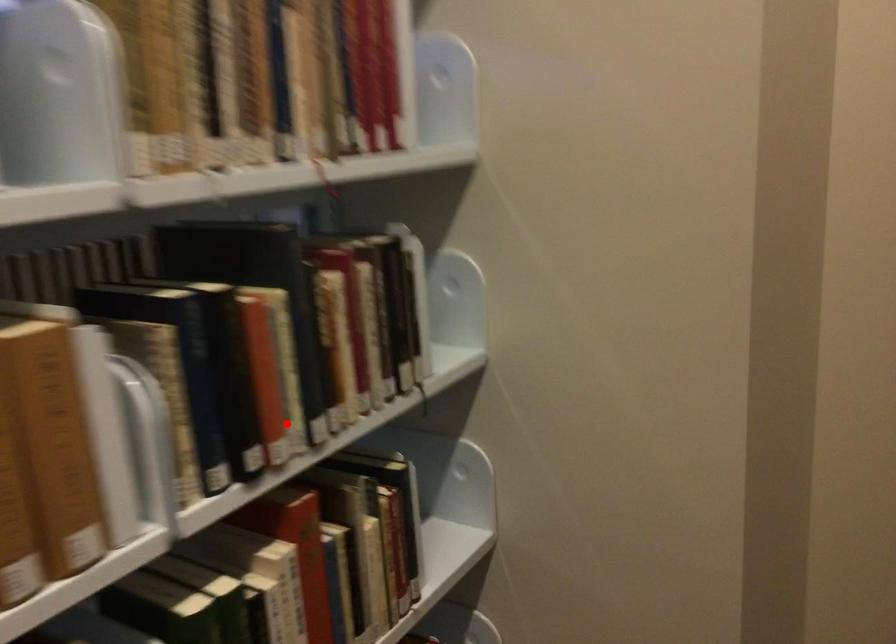
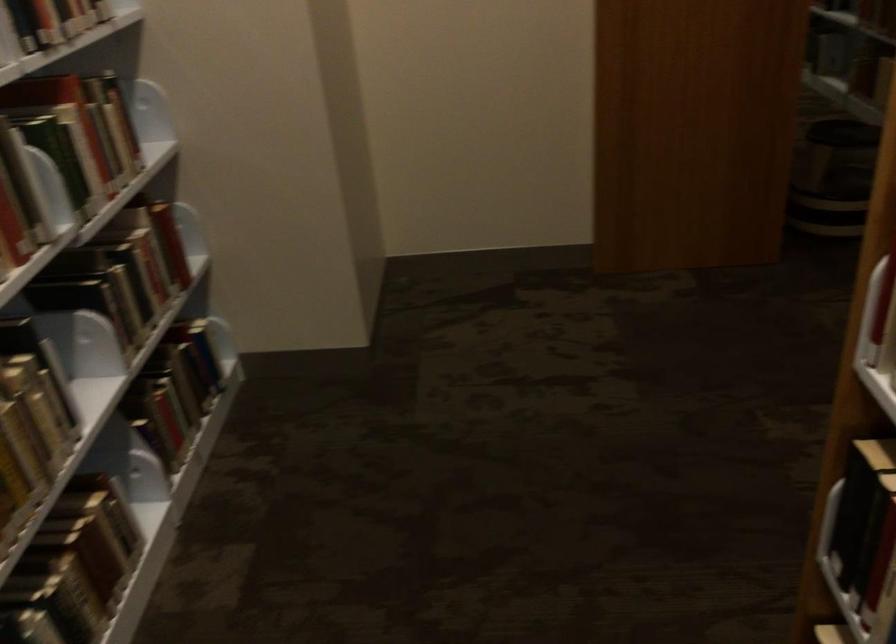
Question: I am providing you with two images of the same scene from different viewpoints. A red point is shown in image1. For the corresponding object point in image2, is it positioned nearer or farther from the camera?

Choices:
 (A) Nearer
 (B) Farther

Answer: (B)